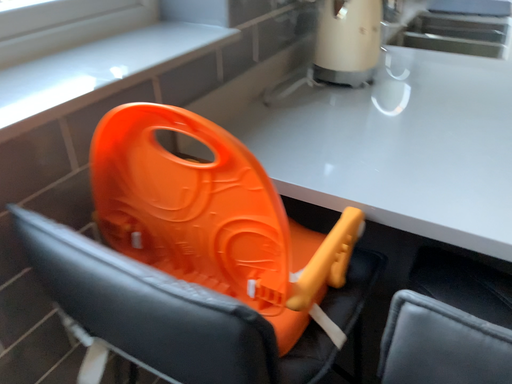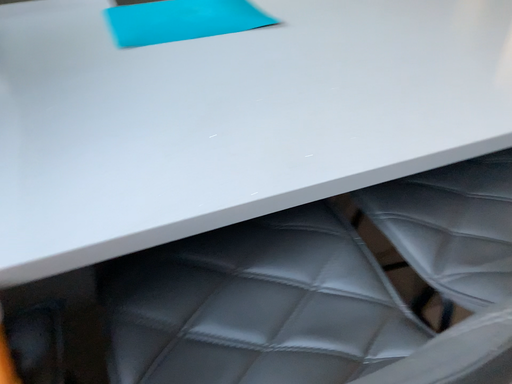
Question: Which way did the camera rotate in the video?

Choices:
 (A) rotated left
 (B) rotated right

Answer: (B)